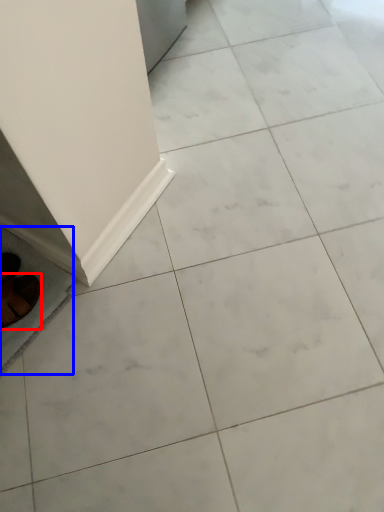
Question: Which point is closer to the camera, footwear (highlighted by a red box) or ceramic tile (highlighted by a blue box)?

Choices:
 (A) footwear
 (B) ceramic tile

Answer: (A)